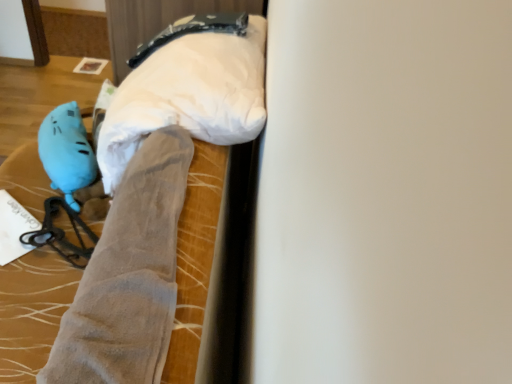
Question: Considering the relative sizes of matte blue plush at left and velvet-like gray blanket at center in the image provided, is matte blue plush at left bigger than velvet-like gray blanket at center?

Choices:
 (A) yes
 (B) no

Answer: (B)

Question: Does matte blue plush at left lie in front of velvet-like gray blanket at center?

Choices:
 (A) yes
 (B) no

Answer: (B)

Question: Is matte blue plush at left shorter than velvet-like gray blanket at center?

Choices:
 (A) yes
 (B) no

Answer: (A)

Question: From a real-world perspective, is matte blue plush at left located beneath velvet-like gray blanket at center?

Choices:
 (A) no
 (B) yes

Answer: (A)

Question: Is matte blue plush at left touching velvet-like gray blanket at center?

Choices:
 (A) yes
 (B) no

Answer: (B)

Question: Does matte blue plush at left have a greater height compared to velvet-like gray blanket at center?

Choices:
 (A) no
 (B) yes

Answer: (A)

Question: Is blue rubber glove at lower left taller than white fabric pillow at upper center?

Choices:
 (A) no
 (B) yes

Answer: (A)

Question: Is the surface of blue rubber glove at lower left in direct contact with white fabric pillow at upper center?

Choices:
 (A) yes
 (B) no

Answer: (B)

Question: From the image's perspective, is blue rubber glove at lower left over white fabric pillow at upper center?

Choices:
 (A) no
 (B) yes

Answer: (A)

Question: Is blue rubber glove at lower left turned away from white fabric pillow at upper center?

Choices:
 (A) yes
 (B) no

Answer: (B)

Question: Is blue rubber glove at lower left thinner than white fabric pillow at upper center?

Choices:
 (A) yes
 (B) no

Answer: (A)

Question: Considering the relative sizes of blue rubber glove at lower left and white fabric pillow at upper center in the image provided, is blue rubber glove at lower left wider than white fabric pillow at upper center?

Choices:
 (A) no
 (B) yes

Answer: (A)

Question: From a real-world perspective, does blue rubber glove at lower left stand above suede-like gray legging at center-left?

Choices:
 (A) no
 (B) yes

Answer: (A)